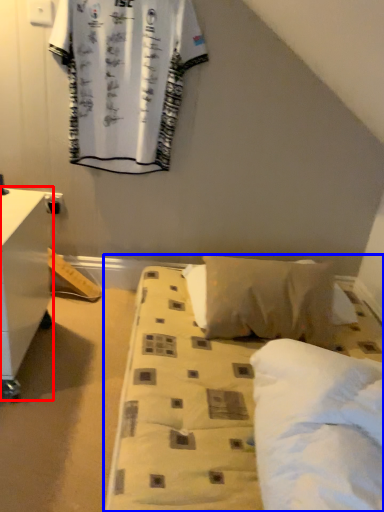
Question: Which point is further to the camera, nightstand (highlighted by a red box) or bed (highlighted by a blue box)?

Choices:
 (A) nightstand
 (B) bed

Answer: (A)